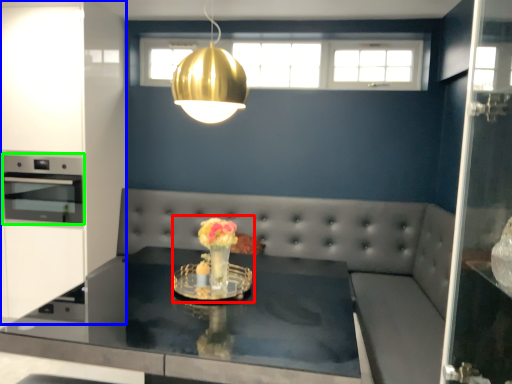
Question: Which object is positioned farthest from floral arrangement (highlighted by a red box)? Select from cabinetry (highlighted by a blue box) and appliance (highlighted by a green box).

Choices:
 (A) cabinetry
 (B) appliance

Answer: (A)